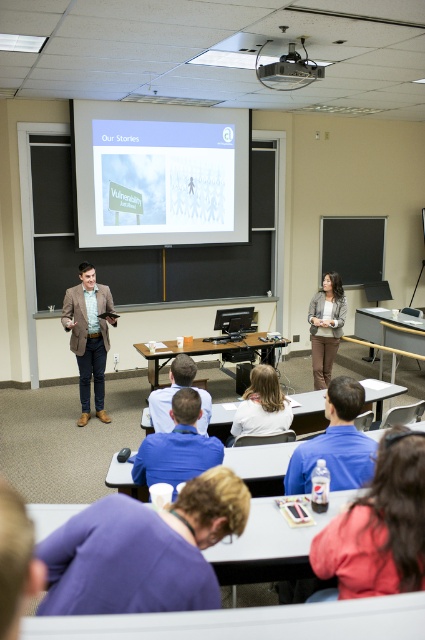
Question: Observing the image, what is the correct spatial positioning of blue cotton shirt at lower center in reference to blue fabric shirt at center?

Choices:
 (A) below
 (B) above

Answer: (A)

Question: Which object is closer to the camera taking this photo?

Choices:
 (A) blue shirt at center
 (B) blue fabric shirt at center

Answer: (A)

Question: From the image, what is the correct spatial relationship of gray fabric jacket at center in relation to matte black projector at upper center?

Choices:
 (A) right
 (B) left

Answer: (A)

Question: Can you confirm if blue cotton shirt at lower center is positioned to the left of white matte shirt at center?

Choices:
 (A) yes
 (B) no

Answer: (B)

Question: Which point is farther from the camera taking this photo?

Choices:
 (A) (407, 516)
 (B) (340, 292)
 (C) (283, 429)

Answer: (B)

Question: Which point is farther to the camera?

Choices:
 (A) (402, 454)
 (B) (78, 289)
 (C) (136, 529)
 (D) (340, 464)

Answer: (B)